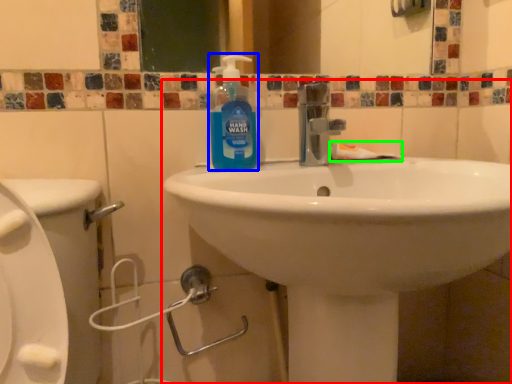
Question: Which is nearer to the sink (highlighted by a red box)? cleaning product (highlighted by a blue box) or toothpaste (highlighted by a green box).

Choices:
 (A) cleaning product
 (B) toothpaste

Answer: (A)